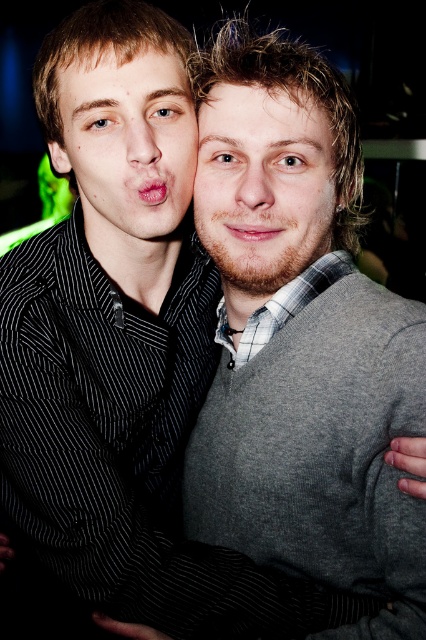
You are a photographer adjusting the focus of your camera. You need to ensure that both the matte black shirt at left and the smooth skin nose at center are in focus. Given that your camera can only focus on objects within a 5 inch range, will both objects be in focus?

The matte black shirt at left is 5.85 inches away from the smooth skin nose at center. Since the distance between them exceeds the camera focus range of 5 inches, both objects cannot be in focus simultaneously.

You are a photographer trying to frame a closeup shot of the two people in the image. You need to know if the matte black shirt at left is wider than the smooth skin nose at center to adjust your camera angle. Can you confirm this?

The matte black shirt at left is wider than the smooth skin nose at center, so yes, the matte black shirt at left is wider than the smooth skin nose at center.

You are taking a photo of two people standing in front of you. You notice two points in the image at coordinates point (268, 163) and point (157, 196). If you want to focus on the point that is closer to you, which coordinate should you choose?

Point (268, 163) is closer to the camera than point (157, 196), so you should choose point (268, 163) to focus on.